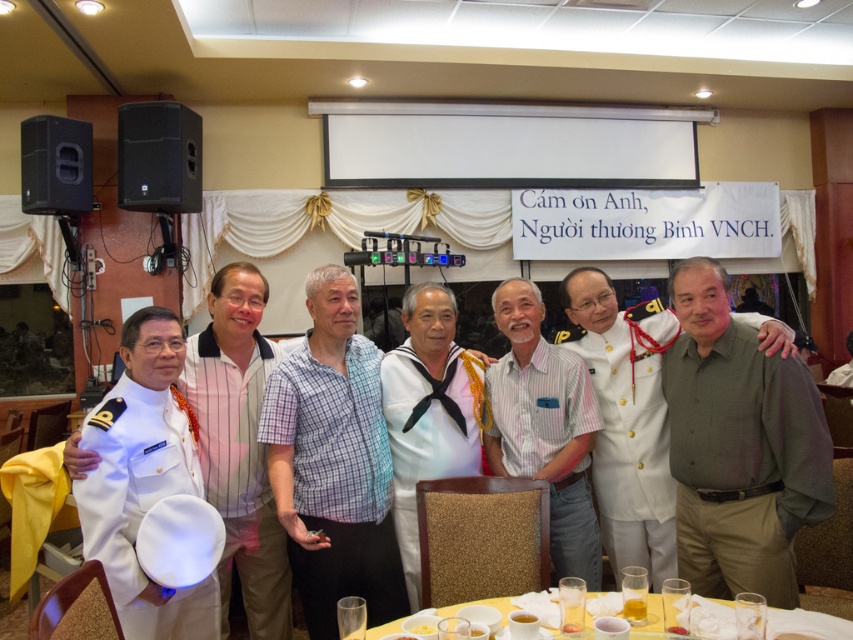
Question: Does white uniform at left have a lesser width compared to green cotton shirt at center?

Choices:
 (A) no
 (B) yes

Answer: (B)

Question: Can you confirm if green cotton shirt at center is positioned below yellow plastic table at lower center?

Choices:
 (A) no
 (B) yes

Answer: (A)

Question: Can you confirm if green cotton shirt at right is positioned below plaid shirt at center?

Choices:
 (A) no
 (B) yes

Answer: (A)

Question: Which of the following is the closest to the observer?

Choices:
 (A) white striped shirt at center
 (B) white cotton sailor shirt at center

Answer: (B)

Question: Which is nearer to the yellow plastic table at lower center?

Choices:
 (A) green cotton shirt at center
 (B) plaid shirt at center
 (C) white cotton sailor shirt at center
 (D) green cotton shirt at right

Answer: (D)

Question: Estimate the real-world distances between objects in this image. Which object is farther from the white striped shirt at center?

Choices:
 (A) green cotton shirt at right
 (B) plaid shirt at center
 (C) green cotton shirt at center
 (D) yellow plastic table at lower center

Answer: (D)